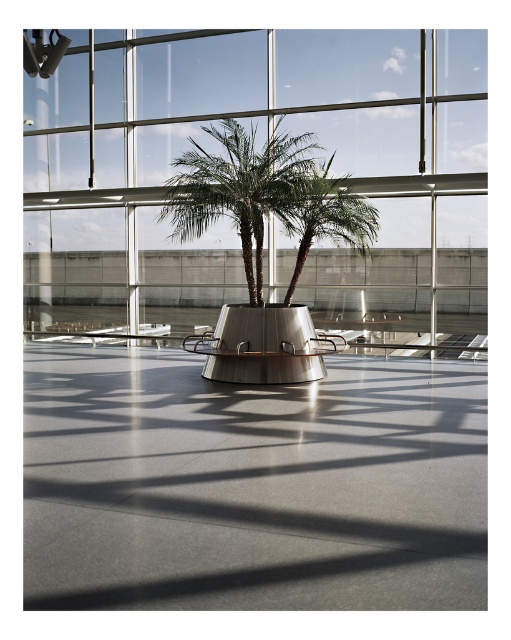
You are standing in the atrium and want to take a photo of the green leafy palm tree at center. The camera you are using has a focus point at coordinate point (x=238, y=188). Will the palm tree be in focus?

The green leafy palm tree at center is located at point (x=238, y=188), so yes, the palm tree will be in focus since the camera focus point matches its location.